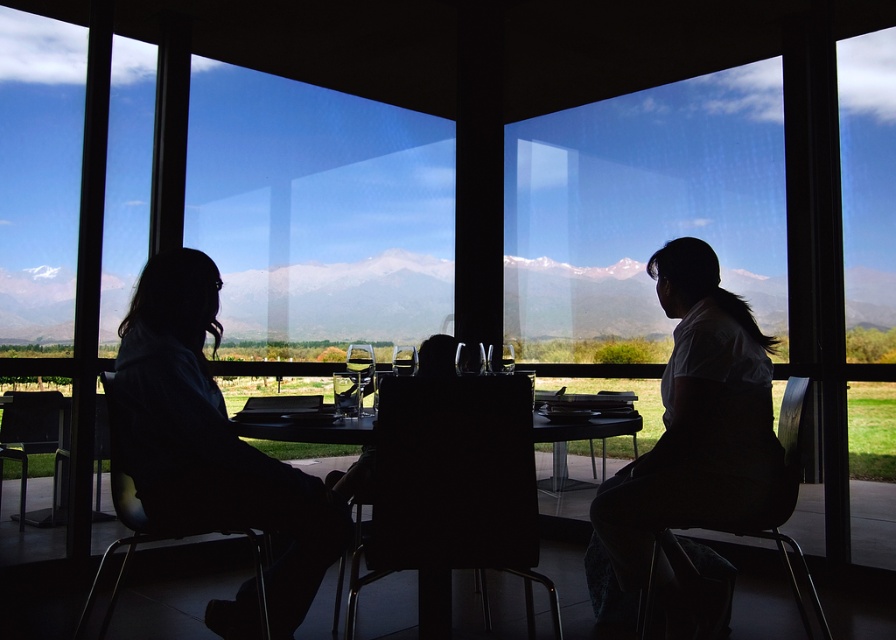
Is point (154, 413) in front of point (142, 358)?

Yes, point (154, 413) is closer to viewer.

This screenshot has width=896, height=640. Describe the element at coordinates (224, 449) in the screenshot. I see `silhouette dress at left` at that location.

Where is `silhouette dress at left`? silhouette dress at left is located at coordinates (224, 449).

Is point (349, 308) positioned in front of point (360, 392)?

No, it is not.

Measure the distance between point (425, 301) and camera.

Point (425, 301) and camera are 6.37 meters apart.

Identify the location of snowy mountain range at upper center. (342, 300).

Who is positioned more to the right, silhouette jacket at center or white matte shirt at center?

From the viewer's perspective, white matte shirt at center appears more on the right side.

Between silhouette jacket at center and white matte shirt at center, which one is positioned lower?

white matte shirt at center

Does point (154, 301) come behind point (668, 387)?

No, (154, 301) is in front of (668, 387).

This screenshot has height=640, width=896. In order to click on silhouette jacket at center in this screenshot , I will do `click(211, 440)`.